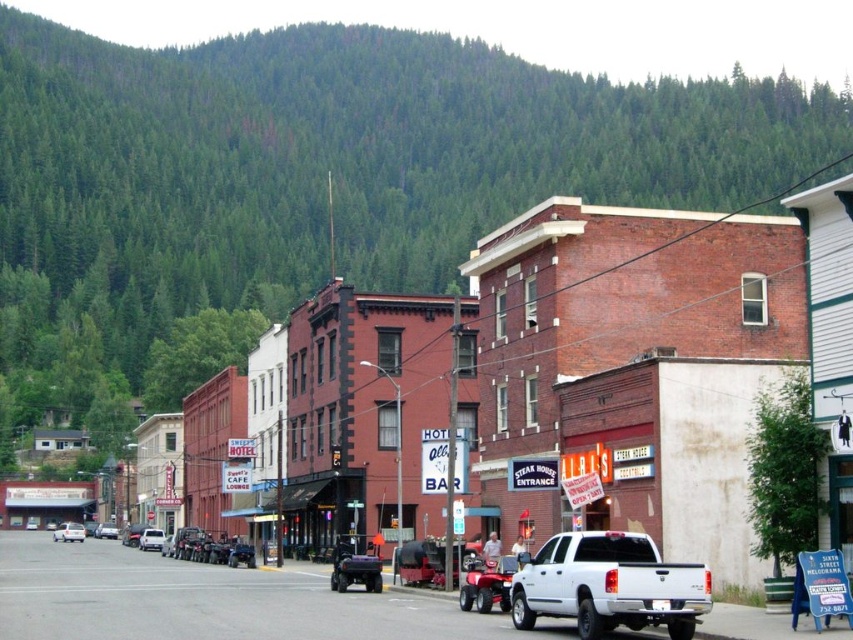
You are a delivery driver who needs to park your vehicle in the street. You see a white matte car at center and a silver metallic sedan at center. Which vehicle is parked higher up on the street?

The white matte car at center is located above the silver metallic sedan at center, so it is parked higher up on the street.